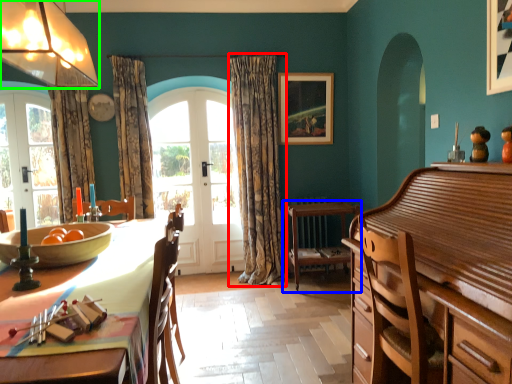
Question: Estimate the real-world distances between objects in this image. Which object is farther from curtain (highlighted by a red box), chair (highlighted by a blue box) or lamp (highlighted by a green box)?

Choices:
 (A) chair
 (B) lamp

Answer: (B)